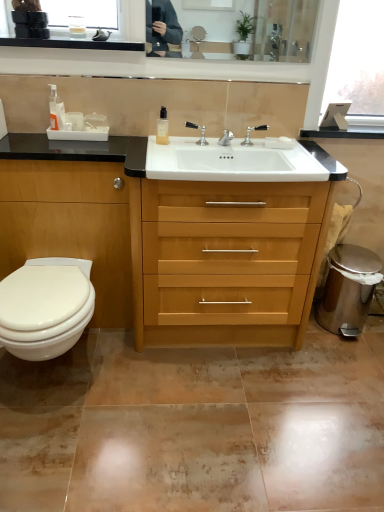
Question: Can you confirm if polished chrome faucet at center is bigger than polished silver faucet at center?

Choices:
 (A) no
 (B) yes

Answer: (A)

Question: From a real-world perspective, is polished chrome faucet at center positioned under polished silver faucet at center based on gravity?

Choices:
 (A) yes
 (B) no

Answer: (B)

Question: Can you confirm if polished chrome faucet at center is smaller than polished silver faucet at center?

Choices:
 (A) no
 (B) yes

Answer: (B)

Question: Is polished silver faucet at center a part of polished chrome faucet at center?

Choices:
 (A) yes
 (B) no

Answer: (B)

Question: Is polished chrome faucet at center beside polished silver faucet at center?

Choices:
 (A) yes
 (B) no

Answer: (B)

Question: From the image's perspective, is translucent plastic bottle at upper left, marked as the first toiletry in a left-to-right arrangement, positioned above or below polished silver faucet at center?

Choices:
 (A) above
 (B) below

Answer: (A)

Question: Is translucent plastic bottle at upper left, acting as the second toiletry starting from the right, spatially inside polished silver faucet at center, or outside of it?

Choices:
 (A) outside
 (B) inside

Answer: (A)

Question: Considering the positions of point (51, 125) and point (196, 143), is point (51, 125) closer or farther from the camera than point (196, 143)?

Choices:
 (A) closer
 (B) farther

Answer: (A)

Question: From a real-world perspective, is translucent plastic bottle at upper left, marked as the first toiletry in a left-to-right arrangement, positioned above or below polished silver faucet at center?

Choices:
 (A) above
 (B) below

Answer: (A)

Question: From a real-world perspective, relative to polished silver faucet at center, is clear glass bottle at center, positioned as the 1th toiletry in right-to-left order, vertically above or below?

Choices:
 (A) below
 (B) above

Answer: (B)

Question: Looking at their shapes, would you say clear glass bottle at center, positioned as the 1th toiletry in right-to-left order, is wider or thinner than polished silver faucet at center?

Choices:
 (A) wide
 (B) thin

Answer: (A)

Question: From the image's perspective, is clear glass bottle at center, positioned as the 1th toiletry in right-to-left order, located above or below polished silver faucet at center?

Choices:
 (A) above
 (B) below

Answer: (A)

Question: Considering the relative positions of clear glass bottle at center, positioned as the 1th toiletry in right-to-left order, and polished silver faucet at center in the image provided, is clear glass bottle at center, positioned as the 1th toiletry in right-to-left order, to the left or to the right of polished silver faucet at center?

Choices:
 (A) right
 (B) left

Answer: (B)

Question: From the image's perspective, is light wood/finish chest of drawers at center located above or below polished chrome faucet at center?

Choices:
 (A) below
 (B) above

Answer: (A)

Question: Considering the positions of light wood/finish chest of drawers at center and polished chrome faucet at center in the image, is light wood/finish chest of drawers at center wider or thinner than polished chrome faucet at center?

Choices:
 (A) wide
 (B) thin

Answer: (A)